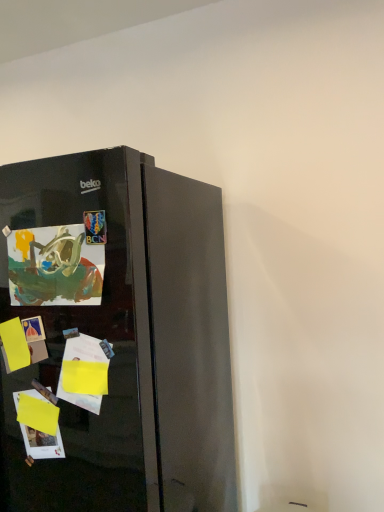
Question: Does matte paper postcard at left appear on the left side of glossy black refrigerator at left?

Choices:
 (A) yes
 (B) no

Answer: (B)

Question: Is matte paper postcard at left smaller than glossy black refrigerator at left?

Choices:
 (A) yes
 (B) no

Answer: (A)

Question: Is matte paper postcard at left outside of glossy black refrigerator at left?

Choices:
 (A) no
 (B) yes

Answer: (A)

Question: Does matte paper postcard at left appear on the right side of glossy black refrigerator at left?

Choices:
 (A) no
 (B) yes

Answer: (B)

Question: Is matte paper postcard at left positioned with its back to glossy black refrigerator at left?

Choices:
 (A) yes
 (B) no

Answer: (A)

Question: From a real-world perspective, does matte paper postcard at left sit lower than glossy black refrigerator at left?

Choices:
 (A) yes
 (B) no

Answer: (B)

Question: From the image's perspective, is glossy black refrigerator at left below matte paper postcard at left?

Choices:
 (A) yes
 (B) no

Answer: (A)

Question: Is glossy black refrigerator at left aimed at matte paper postcard at left?

Choices:
 (A) yes
 (B) no

Answer: (A)

Question: Can you confirm if glossy black refrigerator at left is shorter than matte paper postcard at left?

Choices:
 (A) no
 (B) yes

Answer: (A)

Question: Are glossy black refrigerator at left and matte paper postcard at left making contact?

Choices:
 (A) yes
 (B) no

Answer: (B)

Question: From the image's perspective, is glossy black refrigerator at left over matte paper postcard at left?

Choices:
 (A) no
 (B) yes

Answer: (A)

Question: Is glossy black refrigerator at left taller than matte paper postcard at left?

Choices:
 (A) yes
 (B) no

Answer: (A)

Question: From a real-world perspective, is glossy black refrigerator at left physically located above or below matte paper postcard at left?

Choices:
 (A) above
 (B) below

Answer: (B)